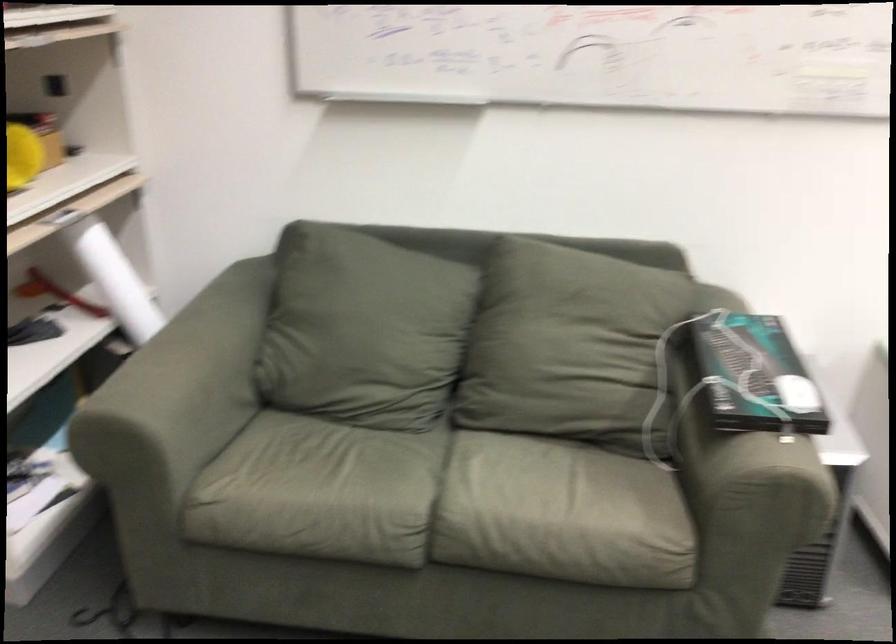
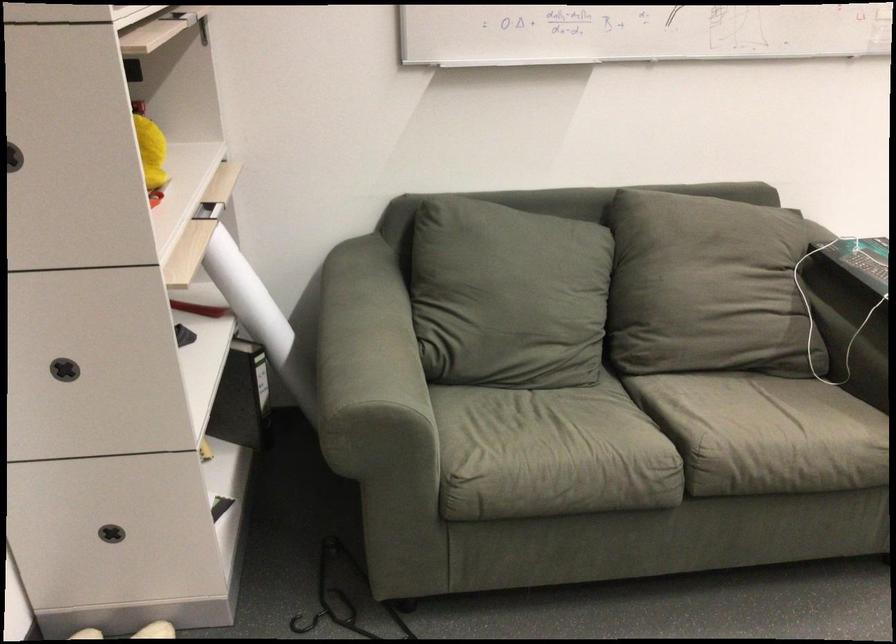
Where in the second image is the point corresponding to (412,500) from the first image?

(653, 444)